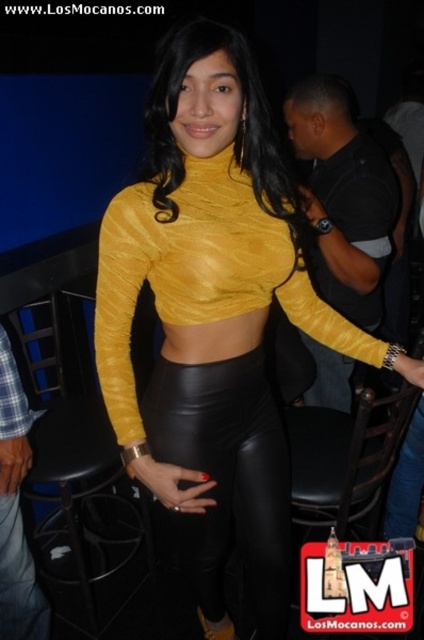
Does black leather skirt at center have a lesser width compared to black leather bar stool at lower center?

No.

Who is lower down, black leather skirt at center or black leather bar stool at lower center?

black leather bar stool at lower center

Who is more distant from viewer, (x=184, y=582) or (x=52, y=410)?

Positioned behind is point (x=184, y=582).

In order to click on black leather skirt at center in this screenshot , I will do `click(222, 490)`.